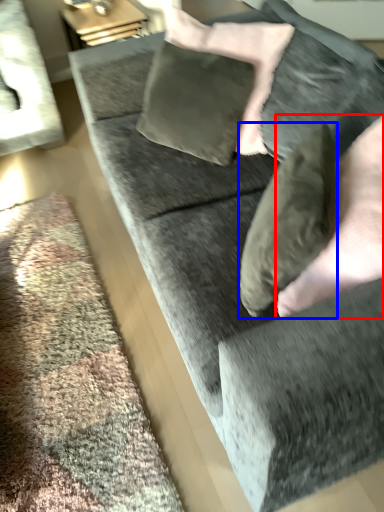
Question: Which object appears closest to the camera in this image, hand (highlighted by a red box) or pillow (highlighted by a blue box)?

Choices:
 (A) hand
 (B) pillow

Answer: (A)